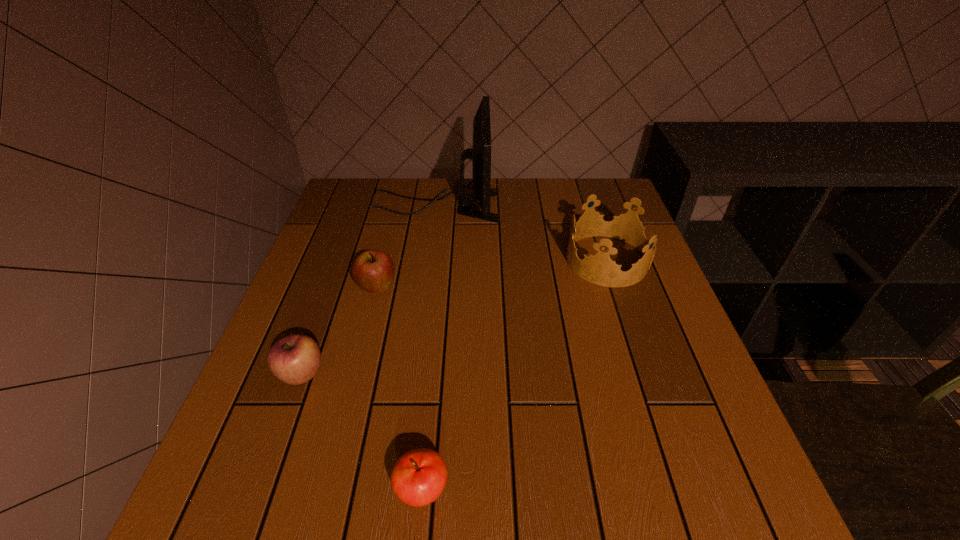
Identify the location of vacant region located 0.320m on the front-facing side of the tiara. (440, 260).

You are a GUI agent. You are given a task and a screenshot of the screen. Output one action in this format:
    pyautogui.click(x=<x>, y=<y>)
    Task: Click on the free space located 0.360m on the front of the farthest apple
    This screenshot has width=960, height=540.
    Given the screenshot: What is the action you would take?
    pyautogui.click(x=335, y=456)

Locate an element on the screen. The image size is (960, 540). free location located 0.360m on the right of the second farthest apple is located at coordinates (511, 374).

Where is `vacant area situated on the back of the shortest object`? vacant area situated on the back of the shortest object is located at coordinates (440, 310).

In order to click on object that is at the far edge in this screenshot , I will do `click(480, 153)`.

Locate an element on the screen. The height and width of the screenshot is (540, 960). object at the near edge is located at coordinates (418, 478).

Where is `computer monitor that is at the left edge`? The height and width of the screenshot is (540, 960). computer monitor that is at the left edge is located at coordinates (480, 153).

The height and width of the screenshot is (540, 960). Identify the location of object at the right edge. point(599,269).

Where is `object located in the far left corner section of the desktop`? object located in the far left corner section of the desktop is located at coordinates (480, 153).

This screenshot has height=540, width=960. Identify the location of free point at the far edge. [x=500, y=204].